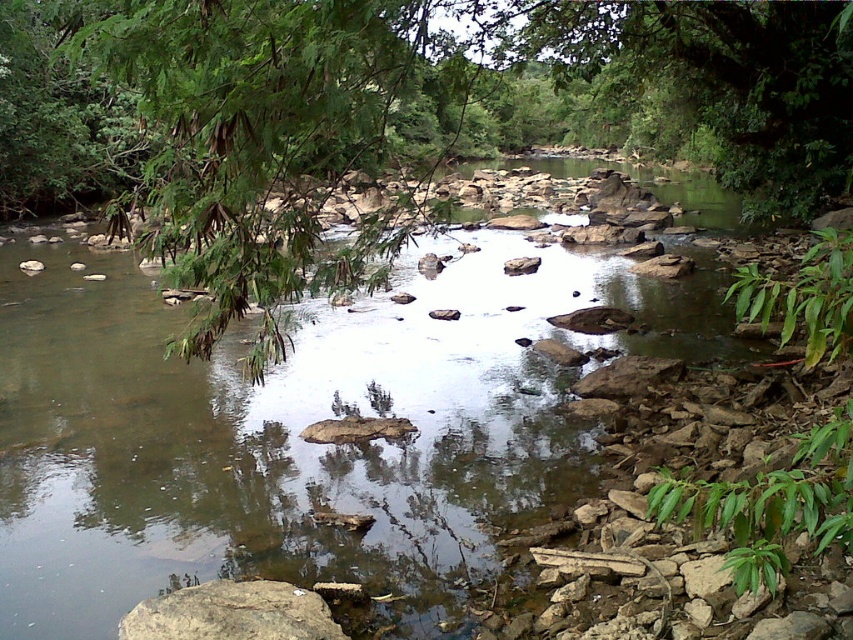
Can you confirm if brown rocky stream at center is bigger than green leafy tree at upper left?

Incorrect, brown rocky stream at center is not larger than green leafy tree at upper left.

This screenshot has width=853, height=640. In order to click on brown rocky stream at center in this screenshot , I will do `click(299, 429)`.

Which is in front, point (138, 484) or point (845, 177)?

Point (138, 484) is in front.

You are a GUI agent. You are given a task and a screenshot of the screen. Output one action in this format:
    pyautogui.click(x=<x>, y=<y>)
    Task: Click on the brown rocky stream at center
    This screenshot has width=853, height=640.
    Given the screenshot: What is the action you would take?
    pyautogui.click(x=299, y=429)

Is point (450, 268) positioned in front of point (267, 628)?

No, (450, 268) is further to viewer.

Between brown rocky stream at center and brown rough rock at lower left, which one appears on the left side from the viewer's perspective?

brown rocky stream at center

Who is more distant from viewer, (512, 490) or (260, 600)?

The point (512, 490) is behind.

At what (x,y) coordinates should I click in order to perform the action: click on brown rocky stream at center. Please return your answer as a coordinate pair (x, y). The width and height of the screenshot is (853, 640). Looking at the image, I should click on (299, 429).

Can you confirm if green leafy tree at upper left is positioned above brown rough rock at lower left?

Indeed, green leafy tree at upper left is positioned over brown rough rock at lower left.

Is green leafy tree at upper left wider than brown rough rock at lower left?

Yes.

Between point (630, 92) and point (198, 632), which one is positioned in front?

Point (198, 632)

The height and width of the screenshot is (640, 853). Find the location of `green leafy tree at upper left`. green leafy tree at upper left is located at coordinates (384, 118).